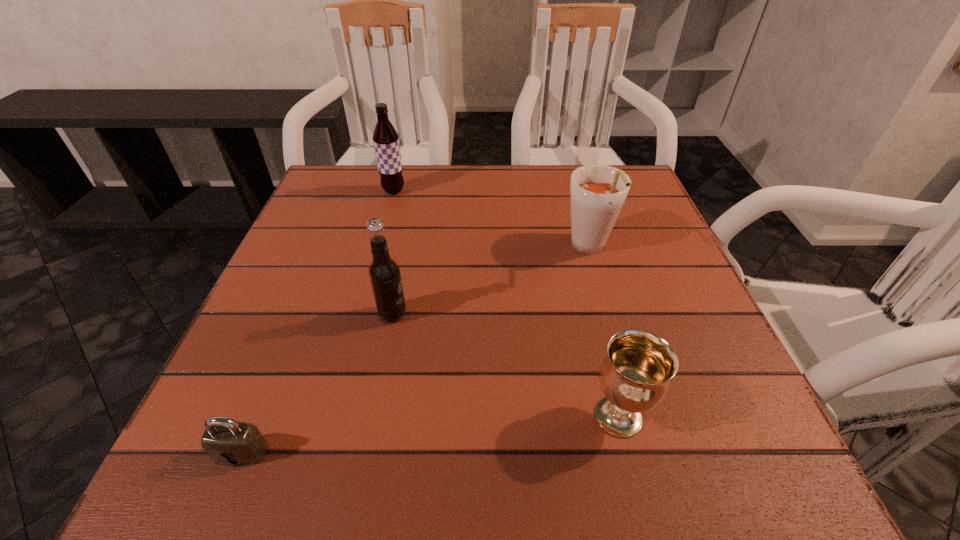
Image resolution: width=960 pixels, height=540 pixels. In order to click on free space located 0.240m on the drink side of the rightmost root beer in this screenshot , I will do `click(624, 374)`.

Identify the location of free region located on the label of the third nearest object. The height and width of the screenshot is (540, 960). click(588, 314).

You are a GUI agent. You are given a task and a screenshot of the screen. Output one action in this format:
    pyautogui.click(x=<x>, y=<y>)
    Task: Click on the free space located 0.240m on the back of the fourth tallest object
    
    Given the screenshot: What is the action you would take?
    pos(585,284)

I want to click on object situated at the far edge, so click(x=386, y=139).

You are a GUI agent. You are given a task and a screenshot of the screen. Output one action in this format:
    pyautogui.click(x=<x>, y=<y>)
    Task: Click on the chalice that is at the near edge
    The image size is (960, 540).
    Given the screenshot: What is the action you would take?
    pyautogui.click(x=635, y=375)

Find the location of a particular element. This screenshot has width=960, height=540. padlock present at the near edge is located at coordinates (228, 442).

Where is `object that is at the left edge`? The height and width of the screenshot is (540, 960). object that is at the left edge is located at coordinates (228, 442).

What are the coordinates of `root beer situated at the right edge` in the screenshot? It's located at click(597, 192).

Where is `chalice that is positioned at the right edge`? This screenshot has height=540, width=960. chalice that is positioned at the right edge is located at coordinates (635, 375).

Find the location of a particular element. object located at the near left corner is located at coordinates (228, 442).